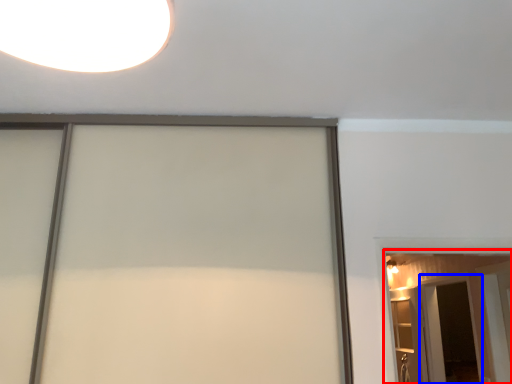
Question: Which object is further to the camera taking this photo, barn door (highlighted by a red box) or screen door (highlighted by a blue box)?

Choices:
 (A) barn door
 (B) screen door

Answer: (B)